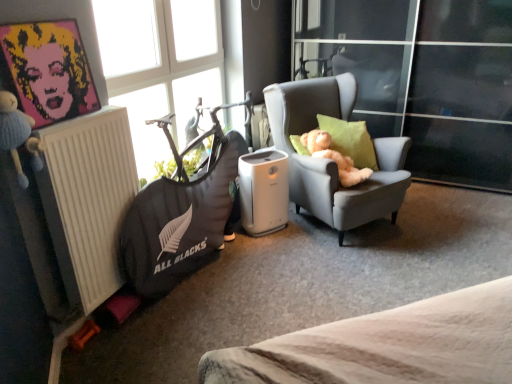
The image size is (512, 384). What are the coordinates of `vacant area that lies between gray fabric armchair at center and dark gray fabric bean bag at left` in the screenshot? It's located at pyautogui.click(x=263, y=267).